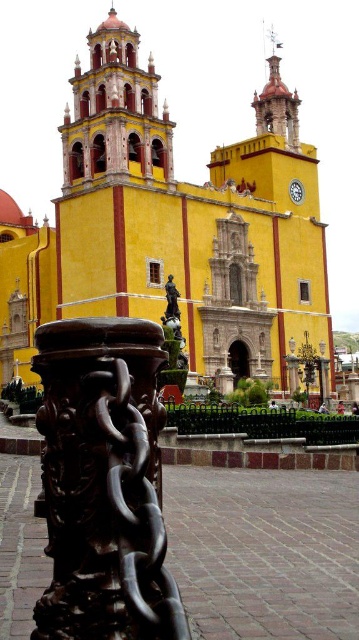
Between yellow stone church at center and matte yellow tower at upper left, which one appears on the left side from the viewer's perspective?

Positioned to the left is matte yellow tower at upper left.

Can you confirm if yellow stone church at center is wider than matte yellow tower at upper left?

Yes.

Is point (129, 32) closer to camera compared to point (162, 113)?

No.

You are a GUI agent. You are given a task and a screenshot of the screen. Output one action in this format:
    pyautogui.click(x=<x>, y=<y>)
    Task: Click on the yellow stone church at center
    The image size is (359, 640).
    Given the screenshot: What is the action you would take?
    pyautogui.click(x=170, y=227)

Is polished dark brown pillar at center taller than matte yellow tower at upper left?

No.

Who is taller, polished dark brown pillar at center or matte yellow tower at upper left?

matte yellow tower at upper left is taller.

Between point (123, 609) and point (72, 131), which one is positioned behind?

Positioned behind is point (72, 131).

Where is `polished dark brown pillar at center`? polished dark brown pillar at center is located at coordinates (104, 483).

Which of these two, yellow stone church at center or polished dark brown pillar at center, stands taller?

Standing taller between the two is yellow stone church at center.

In the scene shown: Measure the distance between yellow stone church at center and camera.

yellow stone church at center is 68.86 meters from camera.

Where is `yellow stone church at center`? yellow stone church at center is located at coordinates (170, 227).